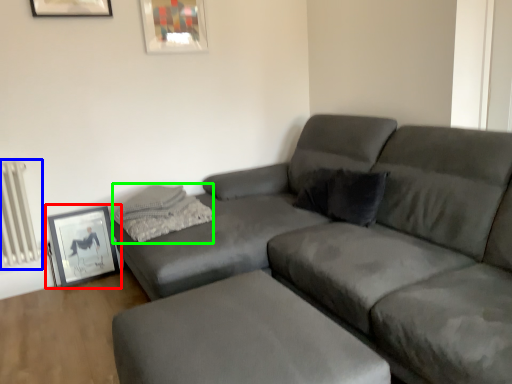
Question: Which object is positioned closest to picture frame (highlighted by a red box)? Select from radiator (highlighted by a blue box) and pillow (highlighted by a green box).

Choices:
 (A) radiator
 (B) pillow

Answer: (A)